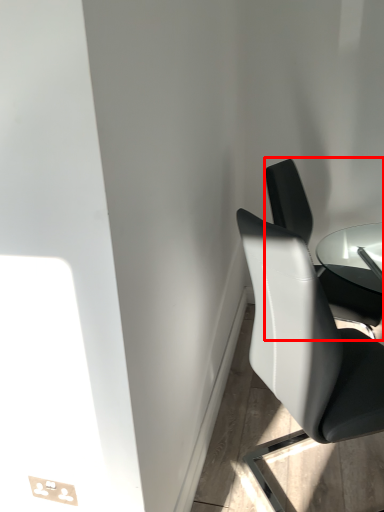
Question: Observing the image, what is the correct spatial positioning of chair (annotated by the red box) in reference to chair?

Choices:
 (A) left
 (B) right

Answer: (B)